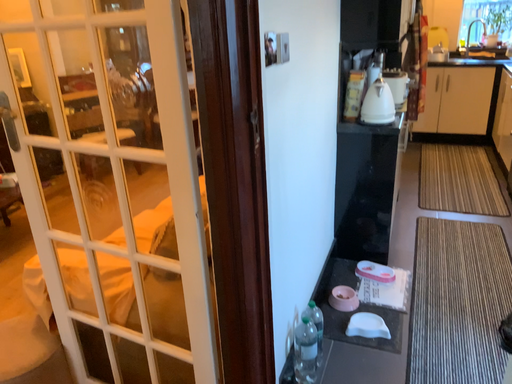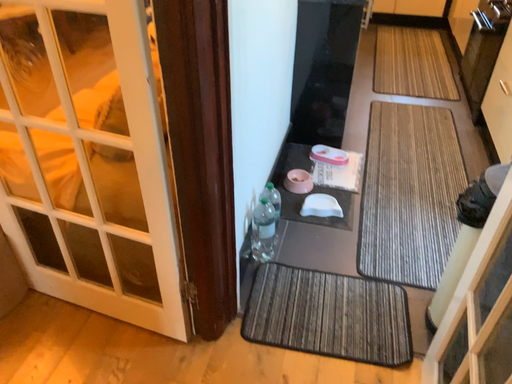
Question: Which way did the camera rotate in the video?

Choices:
 (A) rotated upward
 (B) rotated downward

Answer: (B)